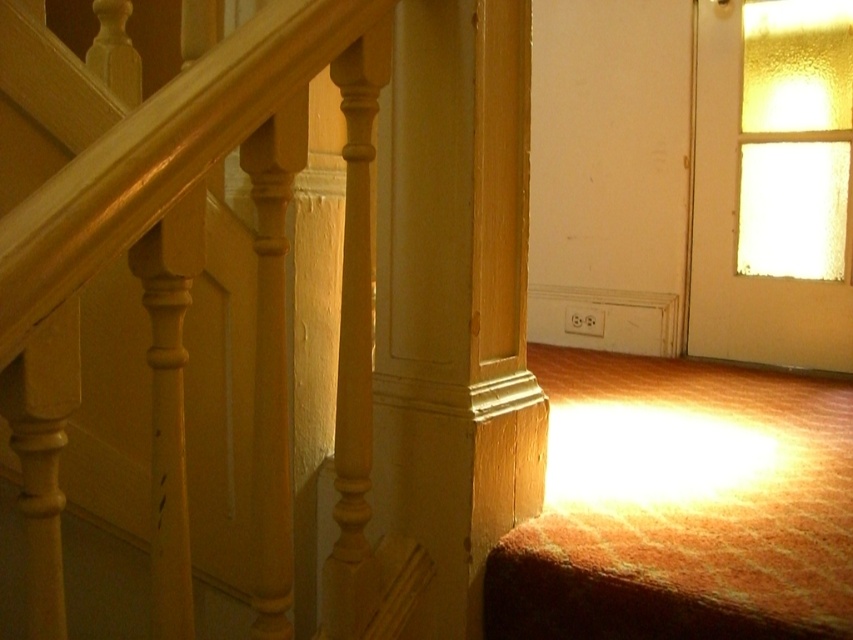
In the scene shown: You are standing at the bottom of the staircase and want to reach the door in the background. You need to pass between the matte wood railing at upper left and the wooden post at center. Which side should you walk on to avoid hitting your head?

You should walk on the side of the wooden post at center because the matte wood railing at upper left is positioned under it, meaning the post is higher and less likely to hit your head.

You are standing at the bottom of the staircase and want to reach the door in the background. There are two points marked on the floor, point (106, 92) and point (424, 451). Which point is closer to the door?

Point (424, 451) is closer to the door because it is in front of point (106, 92).